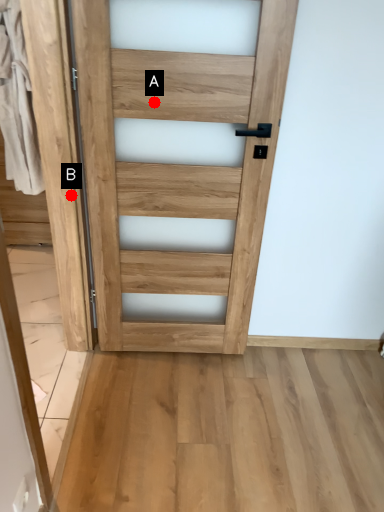
Question: Two points are circled on the image, labeled by A and B beside each circle. Which point is closer to the camera taking this photo?

Choices:
 (A) A is closer
 (B) B is closer

Answer: (A)